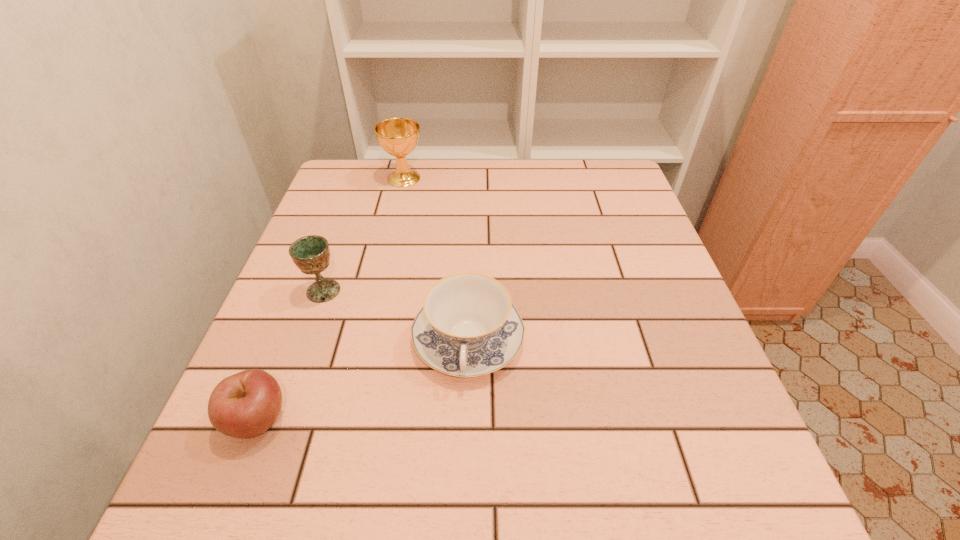
This screenshot has height=540, width=960. In order to click on the second closest object to the chinaware in this screenshot , I will do `click(244, 405)`.

Locate which object is the second closest to the nearest object. Please provide its 2D coordinates. Your answer should be formatted as a tuple, i.e. [(x, y)], where the tuple contains the x and y coordinates of a point satisfying the conditions above.

[(311, 254)]

At what (x,y) coordinates should I click in order to perform the action: click on free space that satisfies the following two spatial constraints: 1. with the handle on the side of the chinaware; 2. on the side of the shortest object with the unique marking. Please return your answer as a coordinate pair (x, y). Looking at the image, I should click on (467, 419).

I want to click on vacant area in the image that satisfies the following two spatial constraints: 1. on the front side of the third object from left to right; 2. on the side of the nearest object with the unique marking, so click(348, 419).